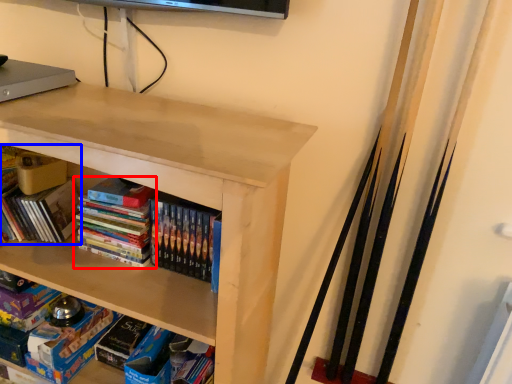
Question: Which object is closer to the camera taking this photo, book (highlighted by a red box) or book (highlighted by a blue box)?

Choices:
 (A) book
 (B) book

Answer: (A)